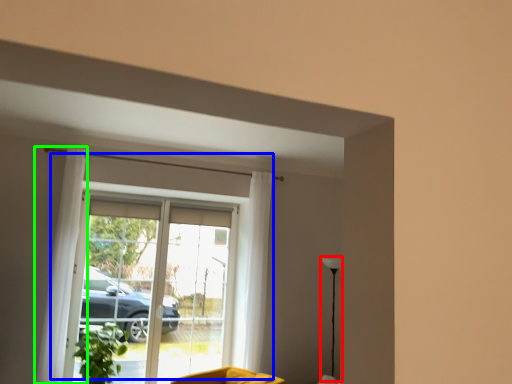
Question: Based on their relative distances, which object is nearer to lamp (highlighted by a red box)? Choose from window (highlighted by a blue box) and curtain (highlighted by a green box).

Choices:
 (A) window
 (B) curtain

Answer: (A)